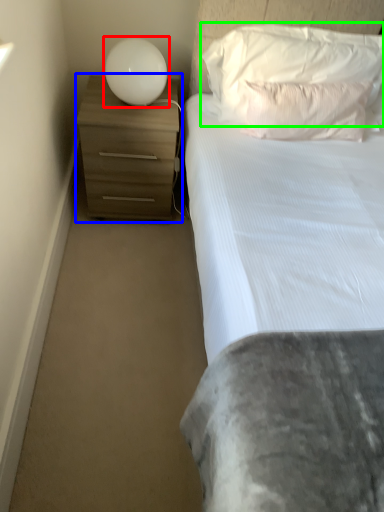
Question: Based on their relative distances, which object is farther from lamp (highlighted by a red box)? Choose from chest of drawers (highlighted by a blue box) and pillow (highlighted by a green box).

Choices:
 (A) chest of drawers
 (B) pillow

Answer: (B)